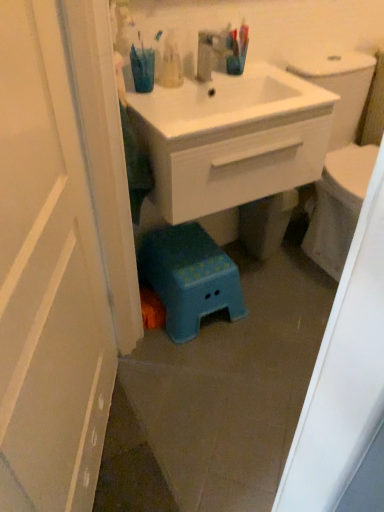
Question: Does teal plastic cup at upper center have a lesser width compared to white glossy door at left?

Choices:
 (A) yes
 (B) no

Answer: (B)

Question: Is teal plastic cup at upper center at the left side of white glossy door at left?

Choices:
 (A) yes
 (B) no

Answer: (B)

Question: Can white glossy door at left be found inside teal plastic cup at upper center?

Choices:
 (A) yes
 (B) no

Answer: (B)

Question: From the image's perspective, is teal plastic cup at upper center under white glossy door at left?

Choices:
 (A) yes
 (B) no

Answer: (B)

Question: Is teal plastic cup at upper center not inside white glossy door at left?

Choices:
 (A) yes
 (B) no

Answer: (A)

Question: Can you confirm if teal plastic cup at upper center is wider than white glossy door at left?

Choices:
 (A) no
 (B) yes

Answer: (B)

Question: Is blue plastic step stool at lower center surrounding translucent plastic toothbrushes at upper center?

Choices:
 (A) yes
 (B) no

Answer: (B)

Question: Considering the relative sizes of blue plastic step stool at lower center and translucent plastic toothbrushes at upper center in the image provided, is blue plastic step stool at lower center shorter than translucent plastic toothbrushes at upper center?

Choices:
 (A) yes
 (B) no

Answer: (B)

Question: Can you confirm if blue plastic step stool at lower center is smaller than translucent plastic toothbrushes at upper center?

Choices:
 (A) no
 (B) yes

Answer: (A)

Question: From a real-world perspective, is blue plastic step stool at lower center physically below translucent plastic toothbrushes at upper center?

Choices:
 (A) no
 (B) yes

Answer: (B)

Question: Is blue plastic step stool at lower center oriented away from translucent plastic toothbrushes at upper center?

Choices:
 (A) yes
 (B) no

Answer: (B)

Question: Is blue plastic step stool at lower center at the left side of translucent plastic toothbrushes at upper center?

Choices:
 (A) no
 (B) yes

Answer: (A)

Question: Can you confirm if white glossy door at left is positioned to the right of translucent plastic toothbrushes at upper center?

Choices:
 (A) no
 (B) yes

Answer: (A)